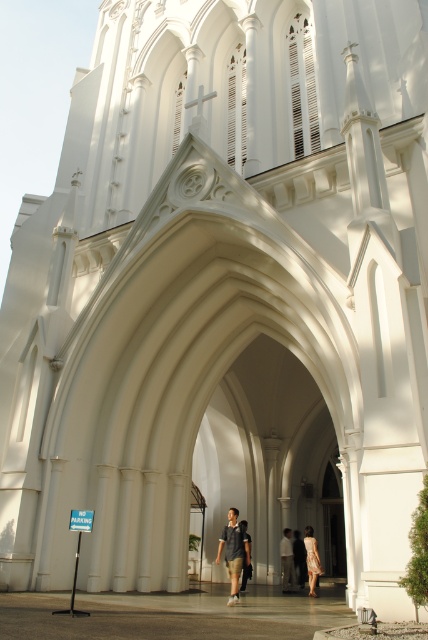
Question: Which point is farther to the camera?

Choices:
 (A) (312, 554)
 (B) (302, 560)

Answer: (B)

Question: Among these points, which one is nearest to the camera?

Choices:
 (A) (312, 547)
 (B) (287, 529)

Answer: (A)

Question: Does dark gray fabric shirt at center have a larger size compared to dark blue shirt at center?

Choices:
 (A) yes
 (B) no

Answer: (A)

Question: Can you confirm if floral dress at center is positioned to the right of light brown fabric dress at center?

Choices:
 (A) no
 (B) yes

Answer: (B)

Question: Which object is closer to the camera taking this photo?

Choices:
 (A) light beige dress at center
 (B) dark blue shirt at center
 (C) light brown fabric dress at center

Answer: (B)

Question: Is dark gray fabric shirt at center below light brown fabric dress at center?

Choices:
 (A) yes
 (B) no

Answer: (B)